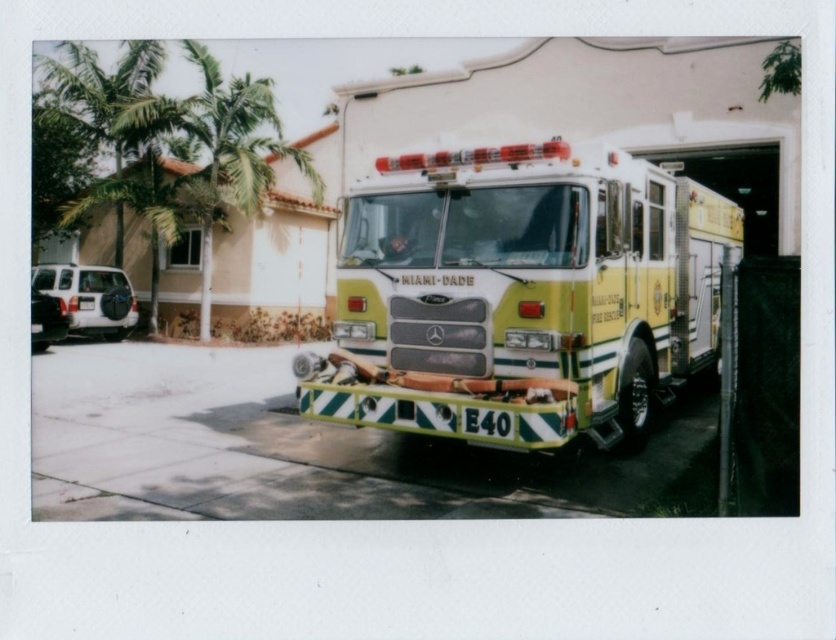
Question: Is yellow-green glossy fire truck at center smaller than white matte suv at left?

Choices:
 (A) yes
 (B) no

Answer: (B)

Question: Which object appears closest to the camera in this image?

Choices:
 (A) yellow-green glossy fire truck at center
 (B) matte black suv at lower left
 (C) green leafy palm tree at upper left
 (D) green leafy palm tree at left

Answer: (A)

Question: Can you confirm if green leafy palm tree at upper left is bigger than green leafy palm tree at left?

Choices:
 (A) no
 (B) yes

Answer: (B)

Question: Among these objects, which one is nearest to the camera?

Choices:
 (A) green leafy palm tree at left
 (B) white matte suv at left
 (C) matte black suv at lower left
 (D) green leafy palm tree at upper left

Answer: (C)

Question: Can you confirm if green leafy palm tree at left is positioned to the right of matte black suv at lower left?

Choices:
 (A) yes
 (B) no

Answer: (B)

Question: Estimate the real-world distances between objects in this image. Which object is farther from the green leafy palm tree at upper left?

Choices:
 (A) yellow-green glossy fire truck at center
 (B) green leafy palm tree at left
 (C) white matte suv at left

Answer: (A)